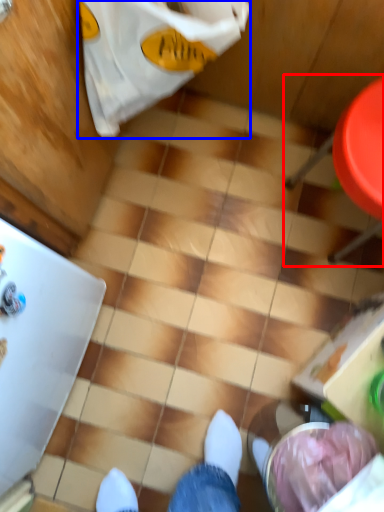
Question: Among these objects, which one is nearest to the camera, chair (highlighted by a red box) or grocery bag (highlighted by a blue box)?

Choices:
 (A) chair
 (B) grocery bag

Answer: (B)